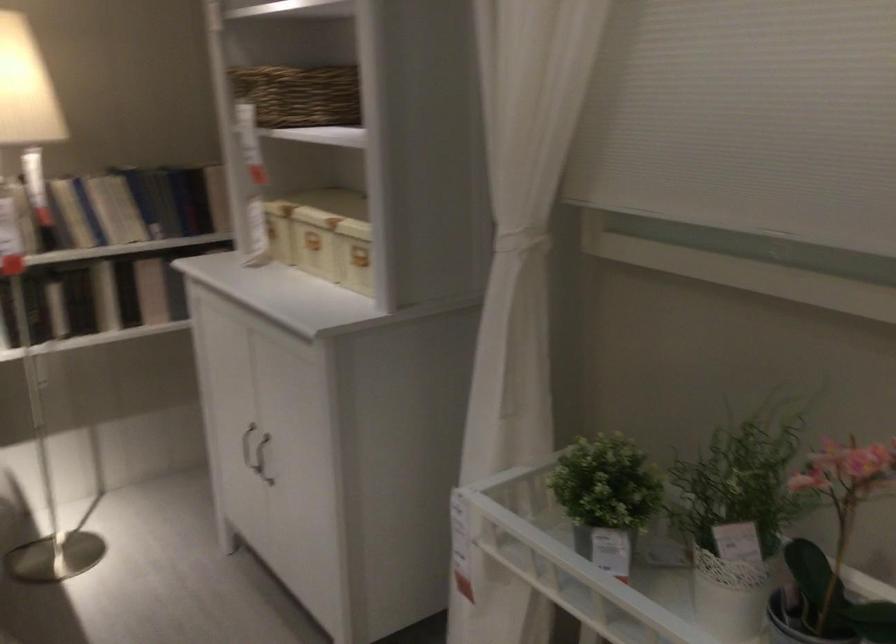
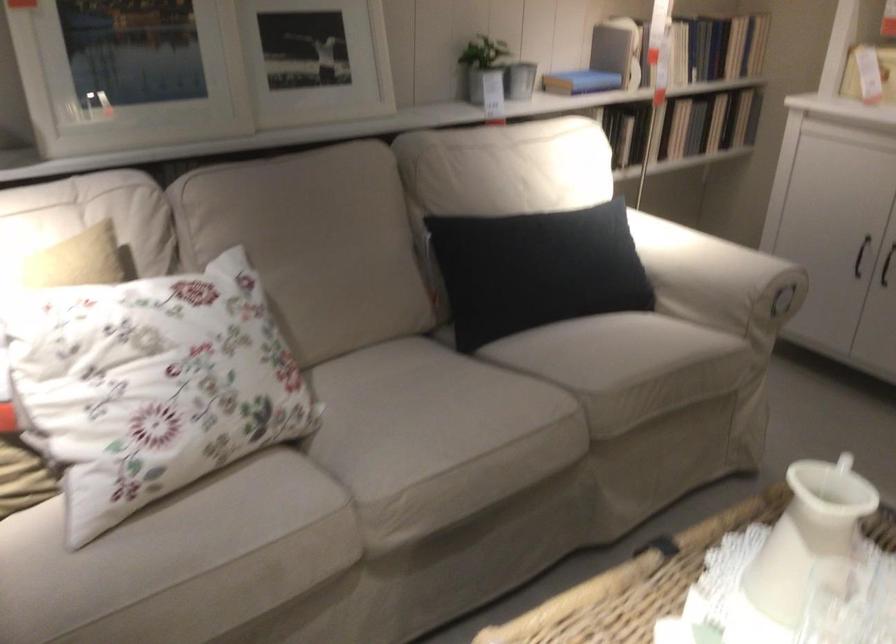
Where in the second image is the point corresponding to (x=236, y=471) from the first image?

(886, 265)